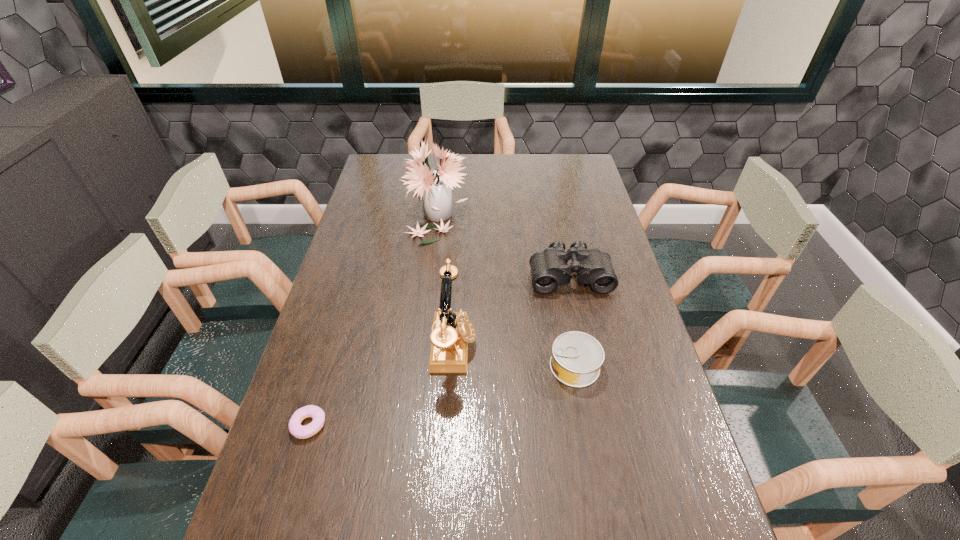
Find the location of `free point at the far right corner`. free point at the far right corner is located at coordinates (551, 158).

What are the coordinates of `empty location between the telephone and the third tallest object` in the screenshot? It's located at (512, 310).

I want to click on free space between the third shortest object and the fourth shortest object, so click(x=512, y=310).

I want to click on vacant region between the binoculars and the bouquet, so click(x=502, y=244).

At what (x,y) coordinates should I click in order to perform the action: click on vacant area that lies between the second tallest object and the doughnut. Please return your answer as a coordinate pair (x, y). The height and width of the screenshot is (540, 960). Looking at the image, I should click on (381, 385).

What are the coordinates of `vacant space that is in between the second farthest object and the second tallest object` in the screenshot? It's located at (512, 310).

Locate an element on the screen. This screenshot has height=540, width=960. blank region between the fourth tallest object and the bouquet is located at coordinates (505, 289).

In order to click on vacant area that lies between the tallest object and the shortest object in this screenshot , I will do `click(372, 319)`.

In order to click on vacant point located between the third tallest object and the fourth tallest object in this screenshot , I will do `click(572, 321)`.

Select which object is the fourth closest to the second shortest object. Please provide its 2D coordinates. Your answer should be formatted as a tuple, i.e. [(x, y)], where the tuple contains the x and y coordinates of a point satisfying the conditions above.

[(296, 429)]